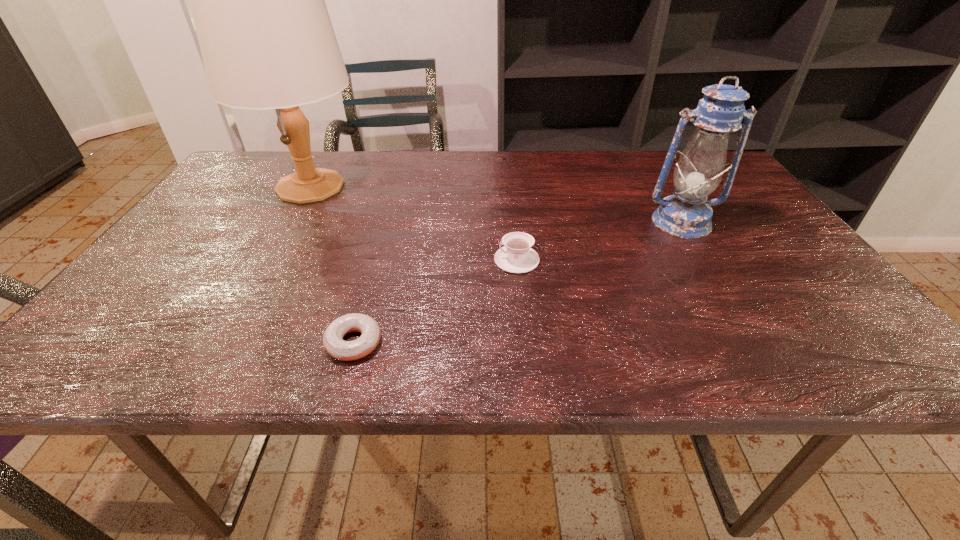
I want to click on vacant space that satisfies the following two spatial constraints: 1. on the front side of the leftmost object; 2. on the left side of the shortest object, so click(220, 342).